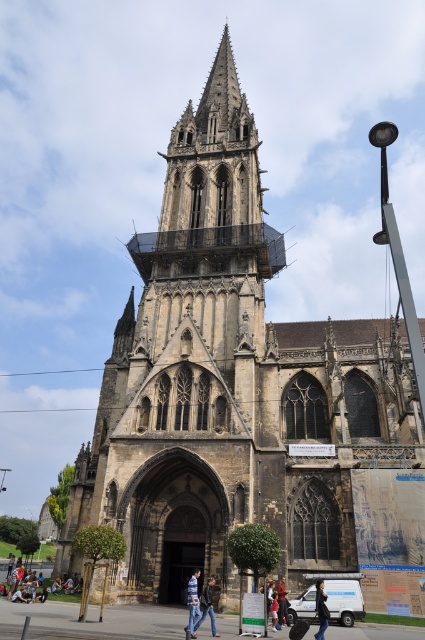
Does striped shirt at center come behind dark blue jeans at center?

No, striped shirt at center is closer to the viewer.

Consider the image. Is striped shirt at center to the right of dark blue jeans at center from the viewer's perspective?

Incorrect, striped shirt at center is not on the right side of dark blue jeans at center.

What are the coordinates of `striped shirt at center` in the screenshot? It's located at (192, 600).

Is point (317, 600) closer to camera compared to point (272, 624)?

That is True.

Between dark blue fabric jacket at lower center and dark blue jeans at center, which one has more height?

dark blue fabric jacket at lower center is taller.

Does point (316, 602) come in front of point (275, 627)?

No.

The image size is (425, 640). In order to click on dark blue fabric jacket at lower center in this screenshot , I will do `click(320, 609)`.

Measure the distance between point (x=209, y=579) and camera.

The distance of point (x=209, y=579) from camera is 164.25 feet.

You are a GUI agent. You are given a task and a screenshot of the screen. Output one action in this format:
    pyautogui.click(x=<x>, y=<y>)
    Task: Click on the denim jacket at lower center
    This screenshot has height=640, width=425.
    Given the screenshot: What is the action you would take?
    pyautogui.click(x=207, y=605)

Find the location of `denim jacket at lower center`. denim jacket at lower center is located at coordinates (207, 605).